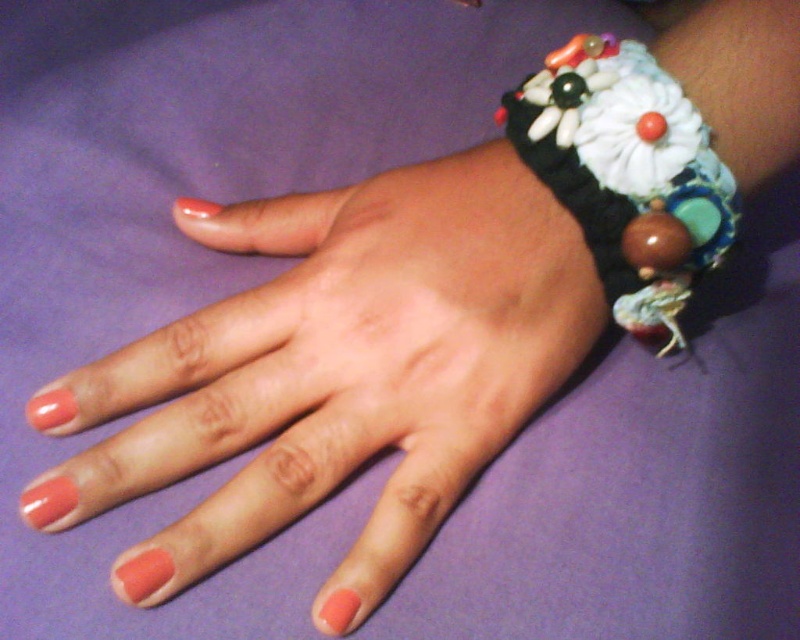
You are a jeweler examining a customer who has a matte black bracelet at upper right on their wrist. You need to place a new ring on their finger. Where should you place the ring so that it is not covered by the bracelet?

Place the ring on the finger below the matte black bracelet at upper right to ensure it is not covered by the bracelet.